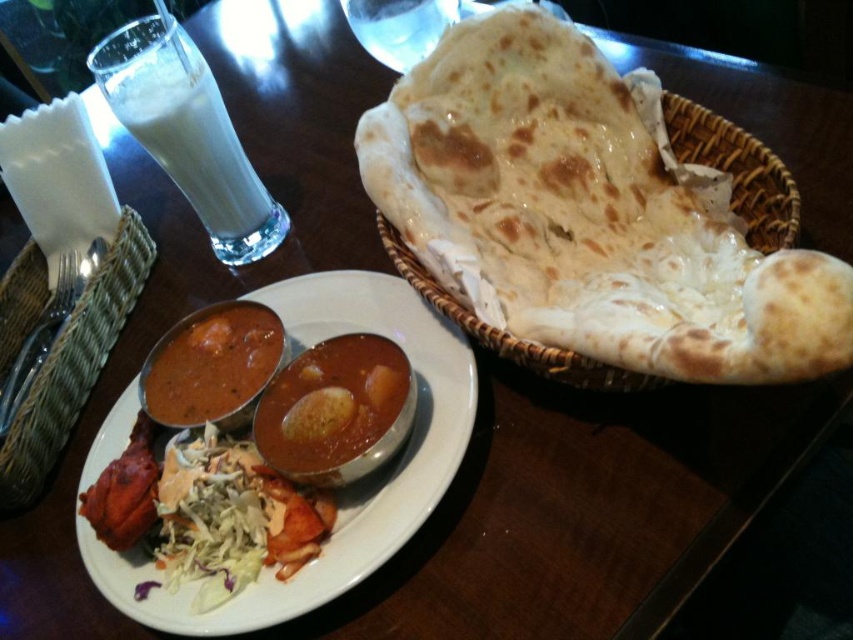
Is white ceramic plate at center thinner than white frothy milk at upper left?

Incorrect, white ceramic plate at center's width is not less than white frothy milk at upper left's.

The image size is (853, 640). Describe the element at coordinates (341, 490) in the screenshot. I see `white ceramic plate at center` at that location.

Locate an element on the screen. white ceramic plate at center is located at coordinates (341, 490).

Can you confirm if white frothy milk at upper left is positioned above smooth brown curry at center?

Indeed, white frothy milk at upper left is positioned over smooth brown curry at center.

Can you confirm if white frothy milk at upper left is taller than smooth brown curry at center?

Yes, white frothy milk at upper left is taller than smooth brown curry at center.

Who is more distant from viewer, (213,168) or (265,362)?

The point (213,168) is behind.

Where is `white frothy milk at upper left`? white frothy milk at upper left is located at coordinates (184, 132).

Does brown woven basket at upper right have a lesser width compared to smokey brown matte curry at center?

In fact, brown woven basket at upper right might be wider than smokey brown matte curry at center.

The width and height of the screenshot is (853, 640). What do you see at coordinates (737, 170) in the screenshot?
I see `brown woven basket at upper right` at bounding box center [737, 170].

I want to click on brown woven basket at upper right, so click(x=737, y=170).